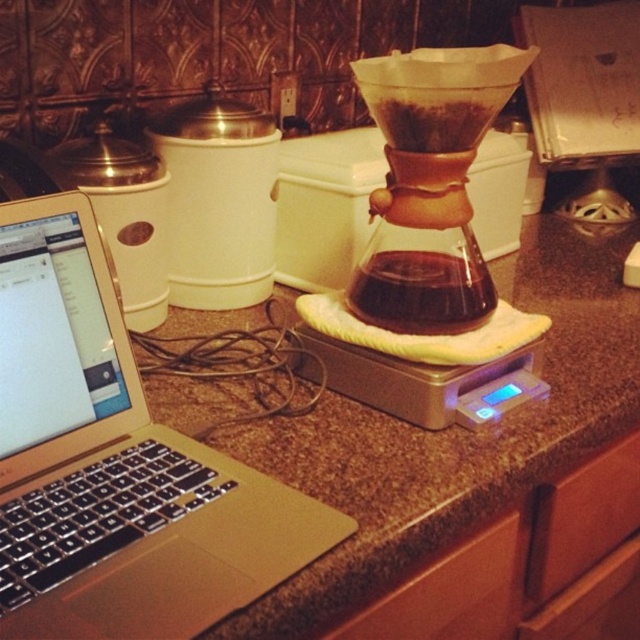
From the picture: You are standing in front of the image and want to touch the two points mentioned. Which point do you need to reach forward more to touch, point (456,292) or point (465,588)?

Point (456,292) is further to the camera than point (465,588), so you need to reach forward more to touch point (456,292).

You are trying to reach for the transparent glass carafe at center while sitting at the counter. Considering the position of the gold metallic laptop at left, will you have to move the laptop to get to the carafe?

The gold metallic laptop at left is located below the transparent glass carafe at center, so you would not need to move the laptop to reach the carafe since it is positioned lower than the carafe.